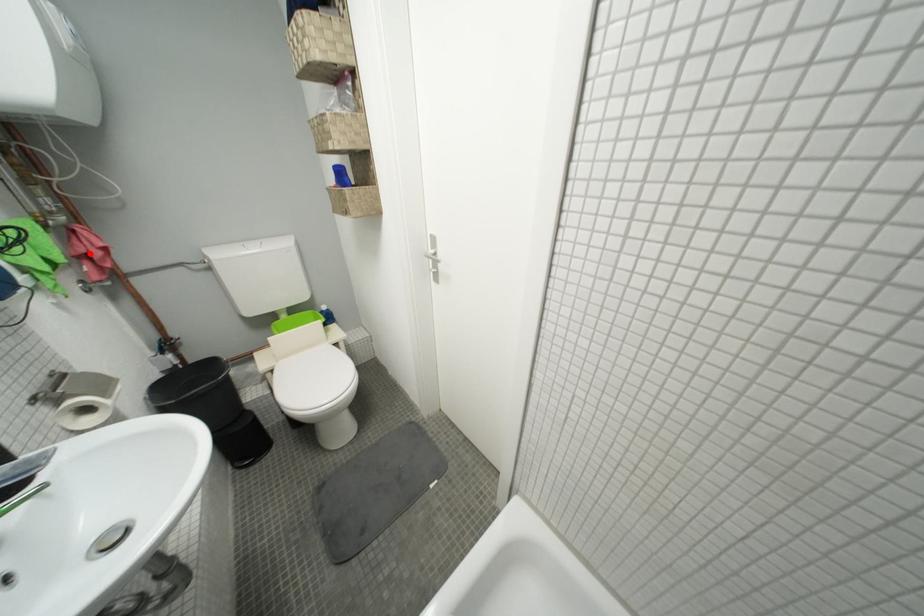
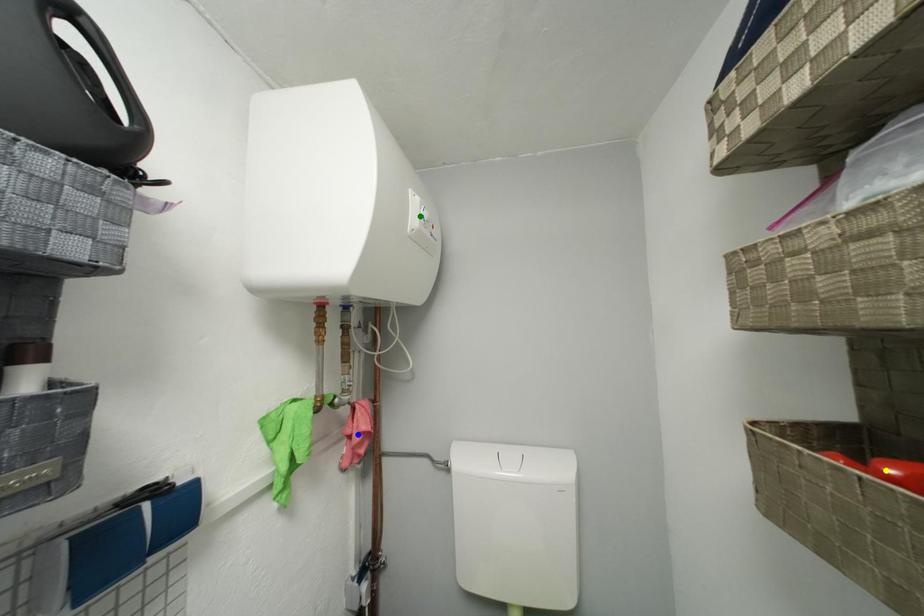
Question: I am providing you with two images of the same scene from different viewpoints. A red point is marked on the first image. You are given multiple points on the second image. Which point in image 2 represents the same 3d spot as the red point in image 1?

Choices:
 (A) green point
 (B) blue point
 (C) yellow point

Answer: (B)